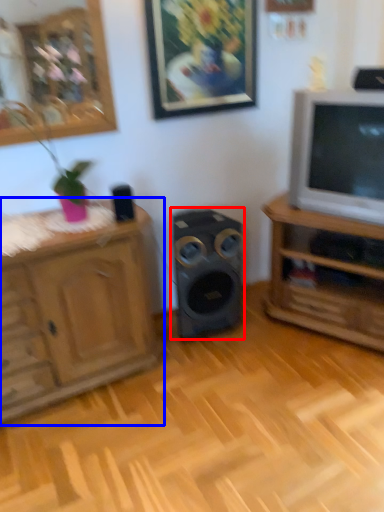
Question: Which object is further to the camera taking this photo, speaker (highlighted by a red box) or cabinetry (highlighted by a blue box)?

Choices:
 (A) speaker
 (B) cabinetry

Answer: (A)